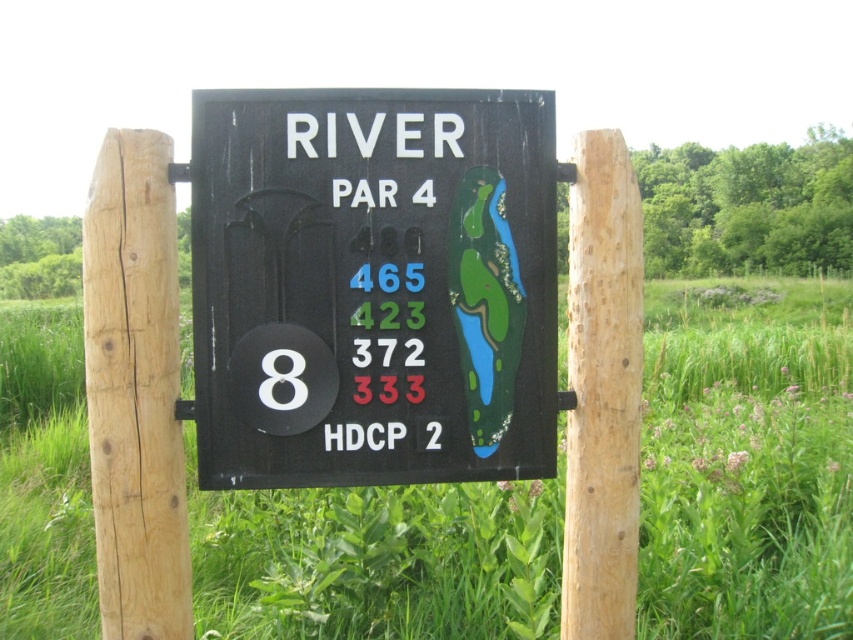
You are a golfer standing in front of the black matte sign at center and the natural wood post at center. Which object is nearer to you?

The black matte sign at center is closer to the viewer than the natural wood post at center, so the black matte sign at center is nearer to you.

You are standing in a golf course and see a sign that has a point marked at coordinates [154,557]. If you want to touch this point on the sign with a 6.5 feet long stick, will you be able to reach it?

The point at coordinates [154,557] is 8.41 feet away from the camera. Since the stick is only 6.5 feet long, you cannot reach the point with the stick.